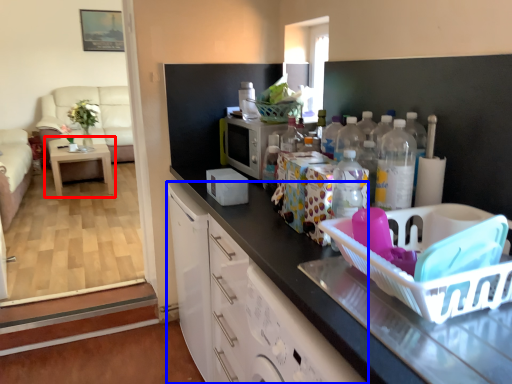
Question: Which of the following is the farthest to the observer, table (highlighted by a red box) or cabinetry (highlighted by a blue box)?

Choices:
 (A) table
 (B) cabinetry

Answer: (A)